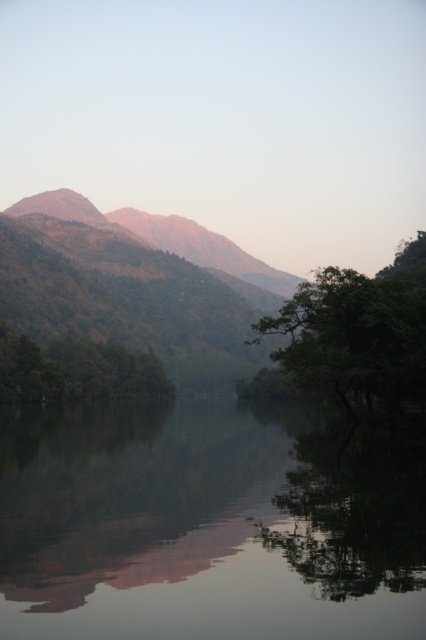
You are an artist trying to paint the landscape. You want to ensure the green leafy tree at right and rustic brown mountain at upper left are proportionally accurate. Which object should you paint smaller?

The green leafy tree at right should be painted smaller than the rustic brown mountain at upper left because the description states it is smaller.